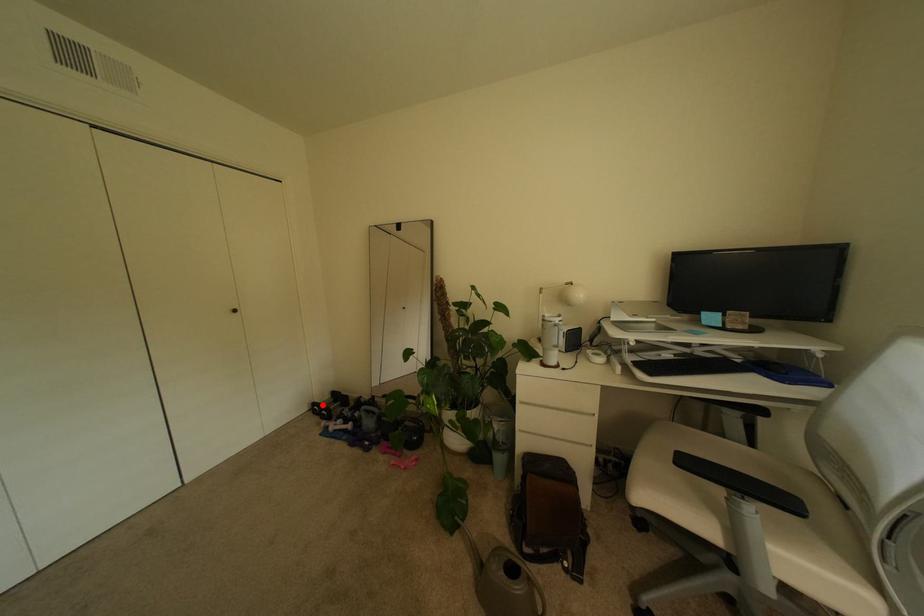
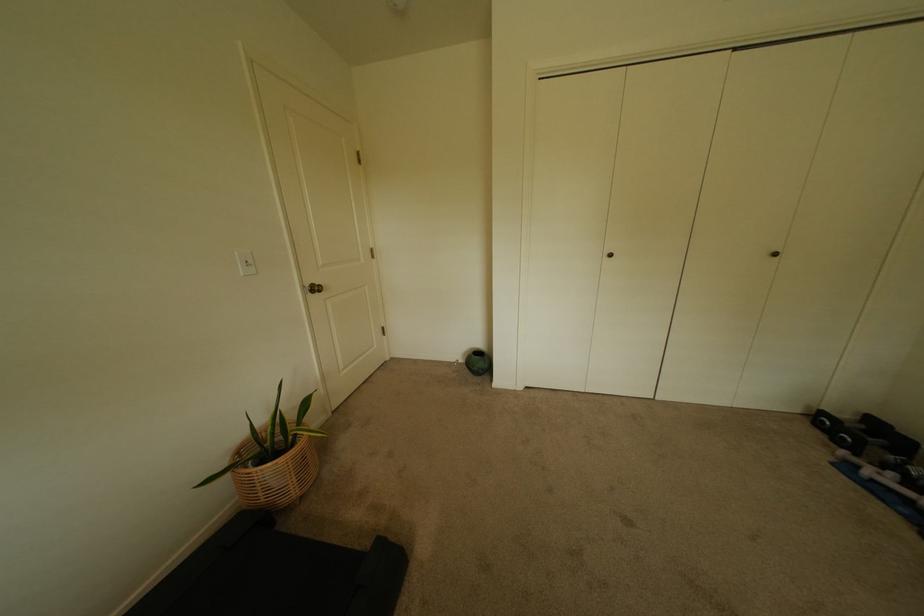
Locate, in the second image, the point that corresponds to the highlighted location in the first image.

(831, 415)